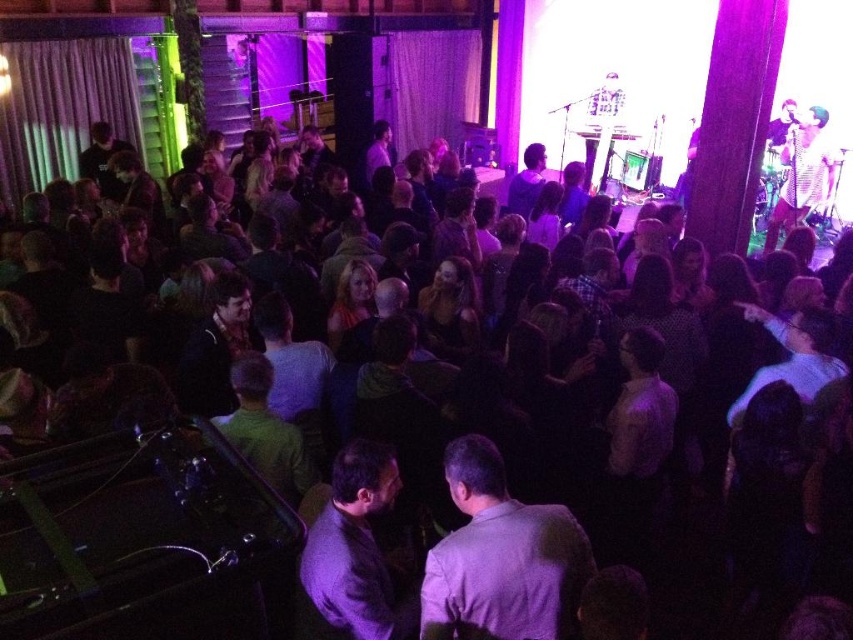
Question: Is light purple shirt at center wider than dark gray suit at center?

Choices:
 (A) yes
 (B) no

Answer: (A)

Question: Can you confirm if light purple shirt at center is smaller than dark gray suit at center?

Choices:
 (A) yes
 (B) no

Answer: (A)

Question: Which of the following is the farthest from the observer?

Choices:
 (A) (569, 564)
 (B) (370, 616)

Answer: (B)

Question: From the image, what is the correct spatial relationship of light purple shirt at center in relation to dark gray suit at center?

Choices:
 (A) left
 (B) right

Answer: (B)